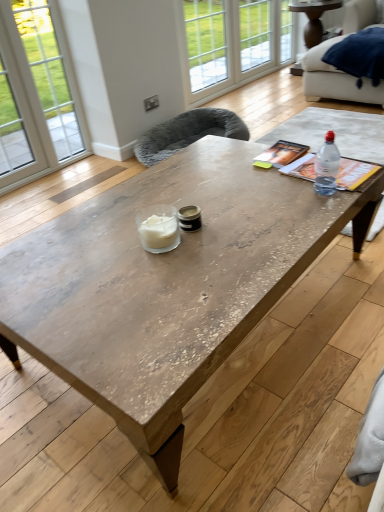
Find the location of a particular element. Image resolution: width=384 pixels, height=512 pixels. vacant point above rustic wood coffee table at center (from a real-world perspective) is located at coordinates (161, 246).